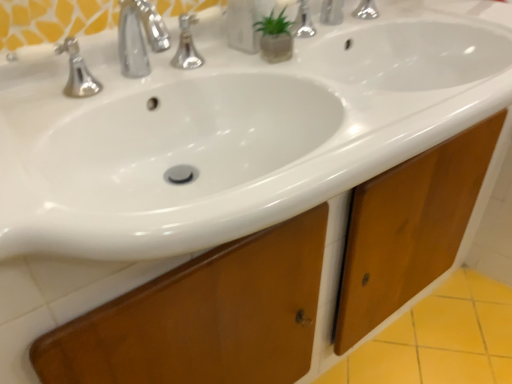
Where is `free point in front of transparent plastic soap dispenser at upper center`? free point in front of transparent plastic soap dispenser at upper center is located at coordinates (267, 78).